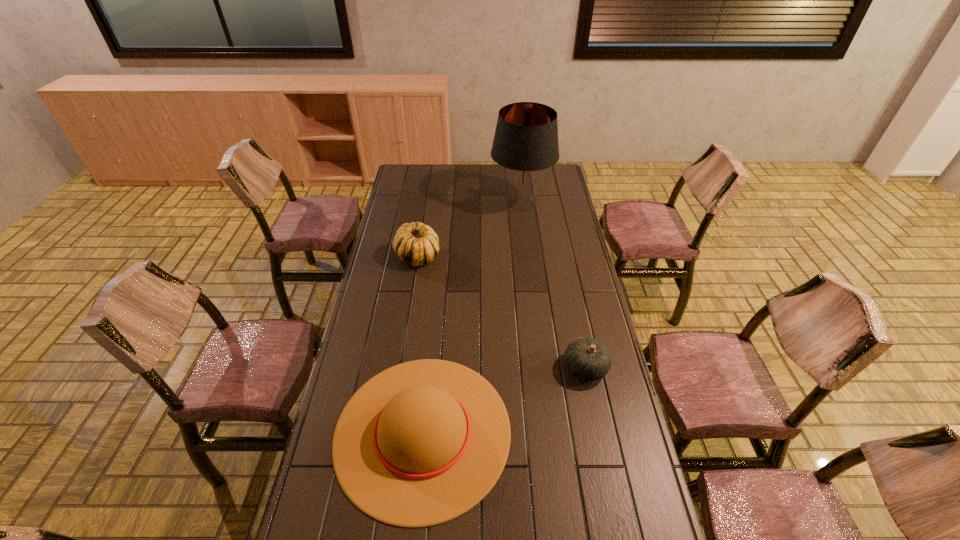
Find the location of a particular element. The image size is (960, 540). the farthest object is located at coordinates (525, 145).

Identify the location of the tallest object. This screenshot has width=960, height=540. (525, 145).

The width and height of the screenshot is (960, 540). Find the location of `the left gourd`. the left gourd is located at coordinates (416, 244).

Where is `the third nearest object`? This screenshot has width=960, height=540. the third nearest object is located at coordinates (416, 244).

You are a GUI agent. You are given a task and a screenshot of the screen. Output one action in this format:
    pyautogui.click(x=<x>, y=<y>)
    Task: Click on the sombrero
    
    Given the screenshot: What is the action you would take?
    pyautogui.click(x=421, y=443)

Where is `the nearer gourd`? The image size is (960, 540). the nearer gourd is located at coordinates (586, 358).

You are a GUI agent. You are given a task and a screenshot of the screen. Output one action in this format:
    pyautogui.click(x=<x>, y=<y>)
    Task: Click on the shorter gourd
    
    Given the screenshot: What is the action you would take?
    pyautogui.click(x=586, y=358)

Where is `free space located 0.300m on the left of the farthest object`? free space located 0.300m on the left of the farthest object is located at coordinates (430, 205).

Identify the location of vacant space located on the right of the left gourd. This screenshot has height=540, width=960. (520, 256).

Find the location of a particular element. vacant space positioned on the right of the sombrero is located at coordinates (561, 431).